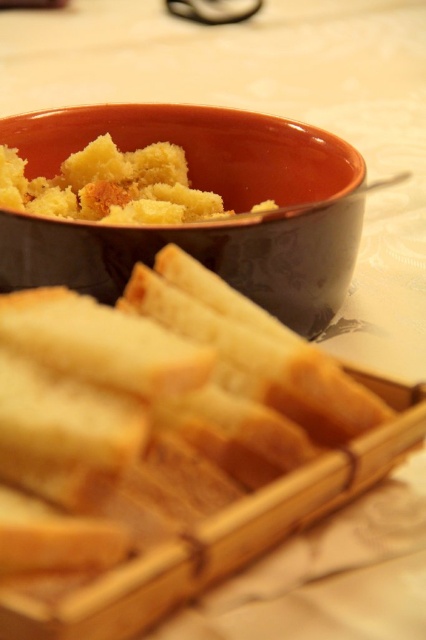
Question: Which object is closer to the camera taking this photo?

Choices:
 (A) matte ceramic bowl at upper center
 (B) yellow crumbly bread at center

Answer: (A)

Question: Is matte ceramic bowl at upper center bigger than yellow crumbly bread at center?

Choices:
 (A) no
 (B) yes

Answer: (B)

Question: Among these objects, which one is nearest to the camera?

Choices:
 (A) yellow crumbly bread at center
 (B) matte ceramic bowl at upper center

Answer: (B)

Question: Among these points, which one is farthest from the camera?

Choices:
 (A) (23, 189)
 (B) (14, 221)

Answer: (A)

Question: Is matte ceramic bowl at upper center above yellow crumbly bread at center?

Choices:
 (A) no
 (B) yes

Answer: (A)

Question: Is matte ceramic bowl at upper center to the right of yellow crumbly bread at center from the viewer's perspective?

Choices:
 (A) no
 (B) yes

Answer: (B)